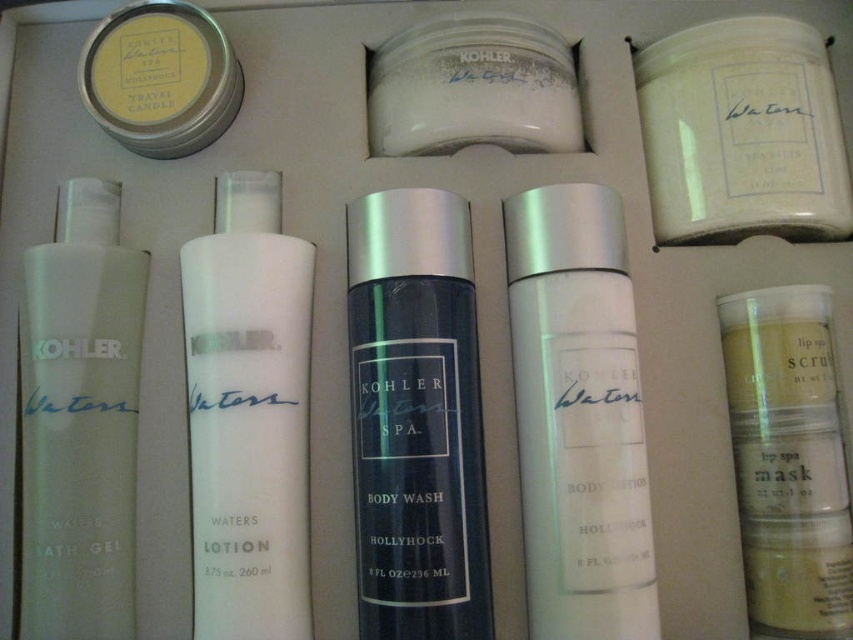
You are organizing spa products on a shelf. You have a matte black body wash at center and a matte yellow lip scrub mask at lower right. Which one requires more shelf space due to its size?

The matte black body wash at center requires more shelf space because it is larger in size than the matte yellow lip scrub mask at lower right.

You are organizing a spa kit and need to place the matte black body wash at center and the matte yellow lip scrub mask at lower right. Based on their positions, which item is covering part of the other?

The matte black body wash at center is positioned over the matte yellow lip scrub mask at lower right, so it is covering part of it.